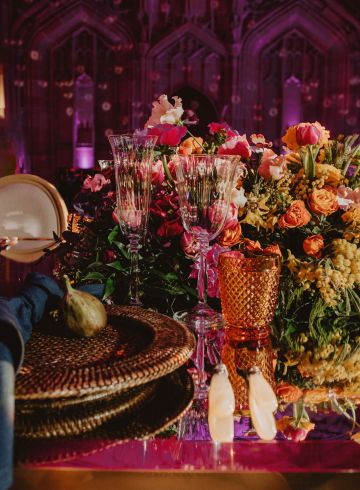
Where is `table edge`? table edge is located at coordinates click(234, 454).